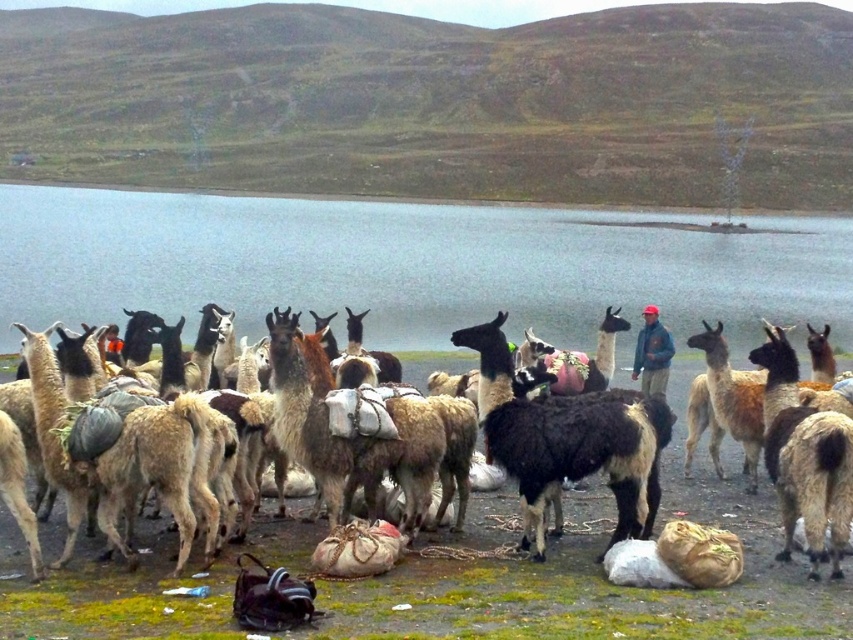
Does blue water at center have a greater width compared to dark blue jacket at center?

Yes.

Is blue water at center below dark blue jacket at center?

No.

Between point (73, 282) and point (648, 312), which one is positioned in front?

Point (648, 312)

Where is `blue water at center`? This screenshot has height=640, width=853. blue water at center is located at coordinates (409, 266).

Does black and white woolen alpaca at center appear under dark blue jacket at center?

Yes.

Can you confirm if black and white woolen alpaca at center is positioned to the right of dark blue jacket at center?

In fact, black and white woolen alpaca at center is to the left of dark blue jacket at center.

Between point (41, 419) and point (653, 346), which one is positioned in front?

Positioned in front is point (41, 419).

What are the coordinates of `black and white woolen alpaca at center` in the screenshot? It's located at (567, 440).

Who is lower down, blue water at center or black and white woolen alpaca at center?

black and white woolen alpaca at center is lower down.

Does point (395, 323) come behind point (474, 342)?

Yes, it is behind point (474, 342).

This screenshot has width=853, height=640. Identify the location of blue water at center. (409, 266).